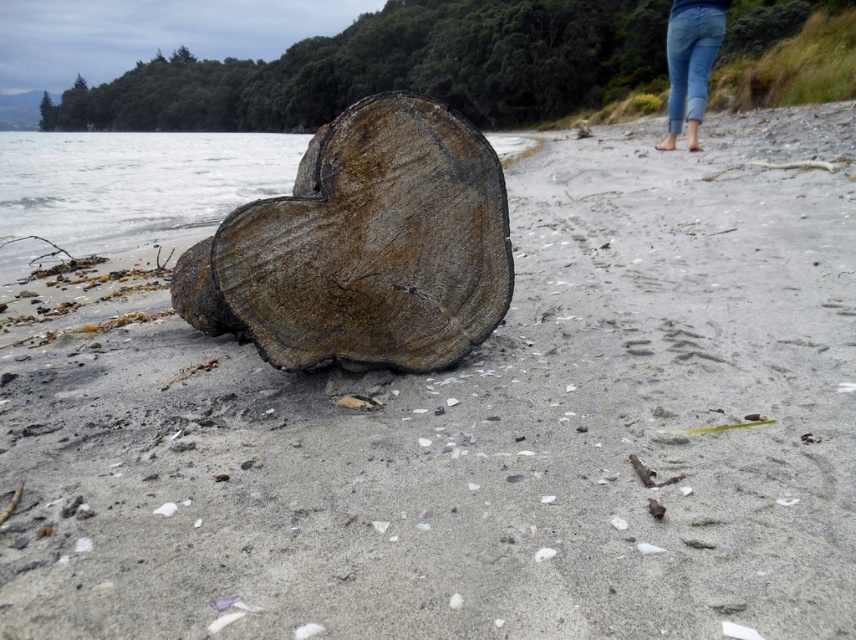
The width and height of the screenshot is (856, 640). In order to click on rusty metallic heart at center in this screenshot , I will do `click(364, 248)`.